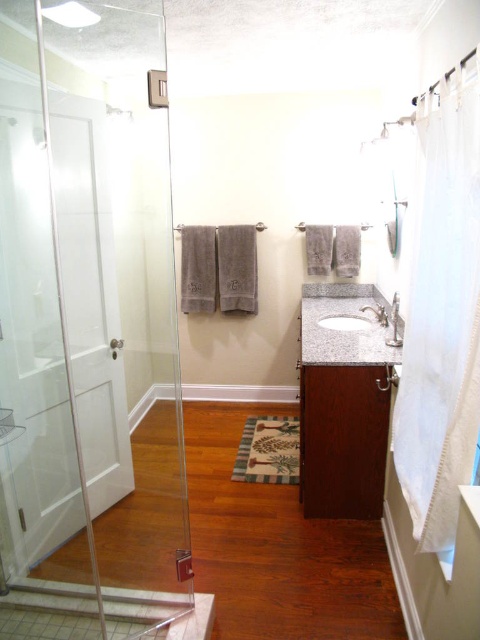
Is point (160, 202) farther from camera compared to point (342, 321)?

No, (160, 202) is closer to viewer.

Does transparent glass shower door at left appear on the left side of granite/stone sink at center?

Correct, you'll find transparent glass shower door at left to the left of granite/stone sink at center.

Between point (28, 410) and point (348, 314), which one is positioned in front?

Positioned in front is point (28, 410).

Find the location of a particular element. transparent glass shower door at left is located at coordinates (87, 324).

Can you confirm if transparent glass shower door at left is bigger than dark wood cabinet at center?

Indeed, transparent glass shower door at left has a larger size compared to dark wood cabinet at center.

Is transparent glass shower door at left above dark wood cabinet at center?

Indeed, transparent glass shower door at left is positioned over dark wood cabinet at center.

Which is in front, point (157, 186) or point (317, 509)?

Point (317, 509)

Where is `transparent glass shower door at left`? The width and height of the screenshot is (480, 640). transparent glass shower door at left is located at coordinates (87, 324).

Is dark wood cabinet at center behind granite/stone sink at center?

No, dark wood cabinet at center is closer to the viewer.

Who is more forward, (308,440) or (347,324)?

Point (308,440) is more forward.

Between point (321, 385) and point (355, 330), which one is positioned in front?

Point (321, 385) is more forward.

The height and width of the screenshot is (640, 480). Identify the location of dark wood cabinet at center. pyautogui.click(x=343, y=440).